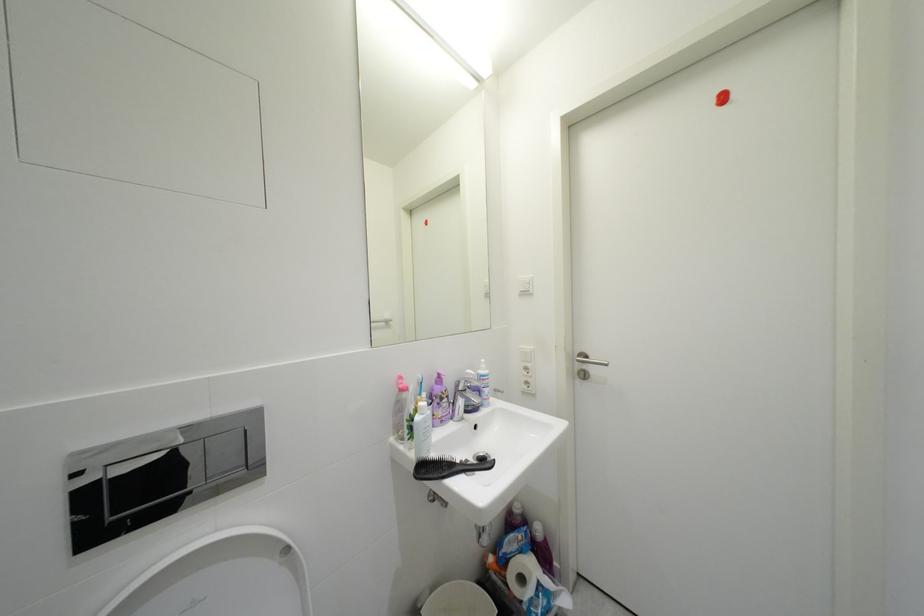
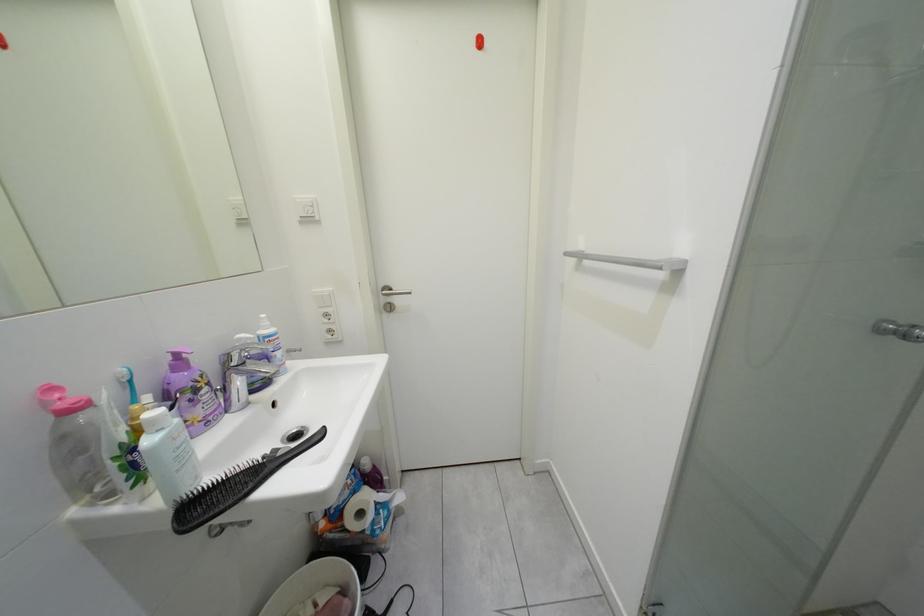
Question: The images are taken continuously from a first-person perspective. In which direction is your viewpoint rotating?

Choices:
 (A) Left
 (B) Right
 (C) Up
 (D) Down

Answer: (B)